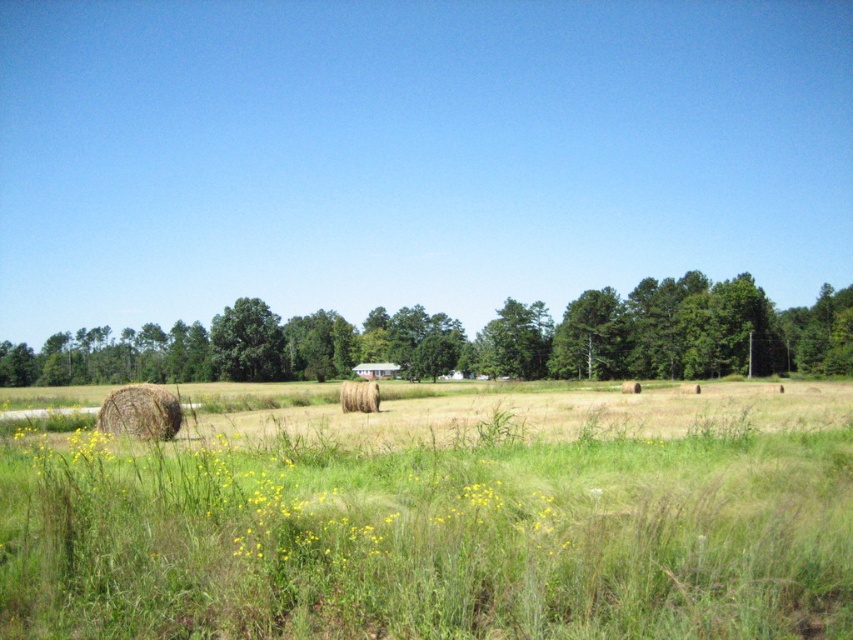
Can you confirm if green matte tree at center is positioned below golden straw bale at center?

Incorrect, green matte tree at center is not positioned below golden straw bale at center.

Is green matte tree at center closer to camera compared to golden straw bale at center?

No.

Describe the element at coordinates (247, 342) in the screenshot. This screenshot has width=853, height=640. I see `green matte tree at center` at that location.

Identify the location of green matte tree at center. (247, 342).

Who is positioned more to the left, green grassy field at center or golden straw bale at center?

From the viewer's perspective, golden straw bale at center appears more on the left side.

Who is more forward, (393, 422) or (345, 406)?

Point (393, 422)

Is point (68, 596) closer to camera compared to point (364, 401)?

Yes, it is in front of point (364, 401).

In order to click on green grassy field at center in this screenshot , I will do `click(442, 515)`.

Is point (283, 372) farther from camera compared to point (276, 342)?

That is False.

Does green leafy tree at center appear over green matte tree at center?

Yes.

Which is in front, point (230, 346) or point (265, 369)?

Point (265, 369) is more forward.

In order to click on green leafy tree at center in this screenshot , I will do `click(471, 340)`.